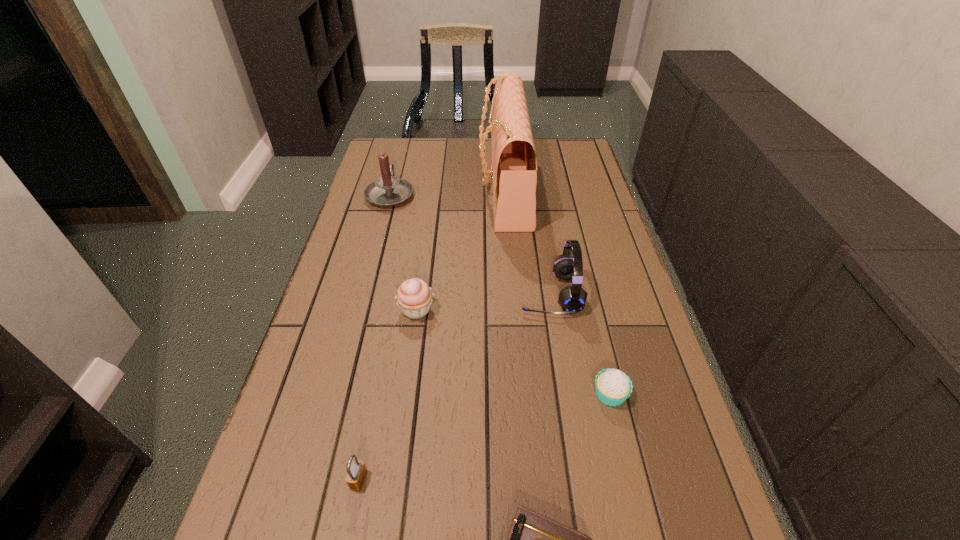
Where is `object that is at the far edge`? This screenshot has height=540, width=960. object that is at the far edge is located at coordinates (514, 163).

I want to click on object located in the left edge section of the desktop, so click(388, 191).

Find the location of `headset located at the right edge`. headset located at the right edge is located at coordinates (572, 299).

Locate an element on the screen. The image size is (960, 540). cupcake located at the right edge is located at coordinates (613, 387).

You are a GUI agent. You are given a task and a screenshot of the screen. Output one action in this format:
    pyautogui.click(x=<x>, y=<y>)
    Task: Click on the free point at the far edge
    The width and height of the screenshot is (960, 540).
    Given the screenshot: What is the action you would take?
    pyautogui.click(x=441, y=162)

Where is `free location at the left edge of the desktop`? free location at the left edge of the desktop is located at coordinates (296, 485).

Find the location of a particular element. vacant area at the right edge is located at coordinates (604, 335).

Find the location of a particular element. The width and height of the screenshot is (960, 540). free spot between the second nearest object and the left cupcake is located at coordinates (388, 395).

The image size is (960, 540). Identify the location of free space between the left cupcake and the handbag. (460, 249).

Where is `free space between the headset and the third nearest object`? This screenshot has width=960, height=540. free space between the headset and the third nearest object is located at coordinates (580, 344).